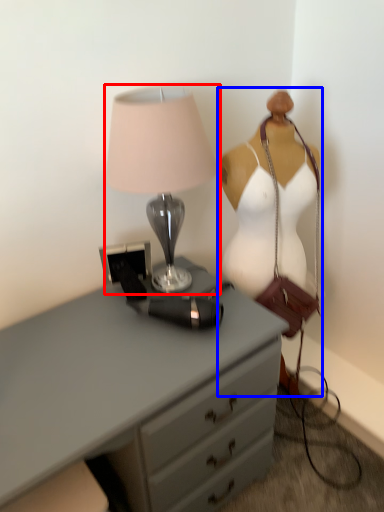
Question: Which of the following is the closest to the observer, lamp (highlighted by a red box) or mannequin (highlighted by a blue box)?

Choices:
 (A) lamp
 (B) mannequin

Answer: (A)